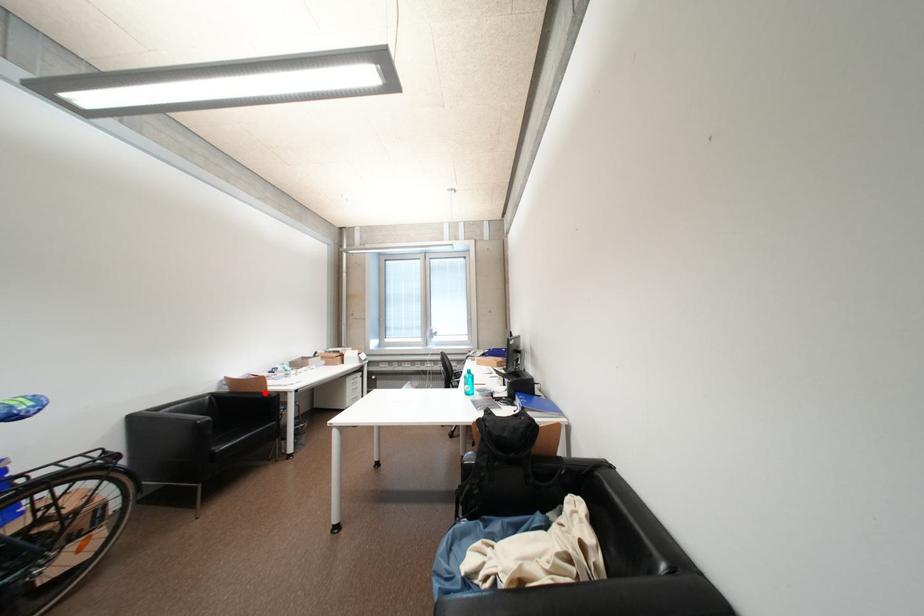
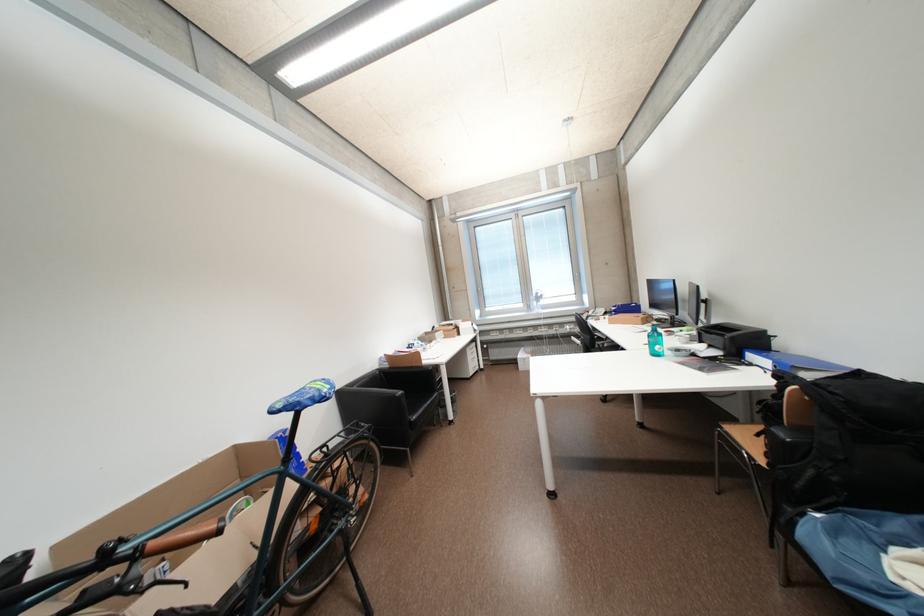
Question: I am providing you with two images of the same scene from different viewpoints. A red point is marked on the first image. At the location where the point appears in image 1, is it still visible in image 2?

Choices:
 (A) Yes
 (B) No

Answer: (A)